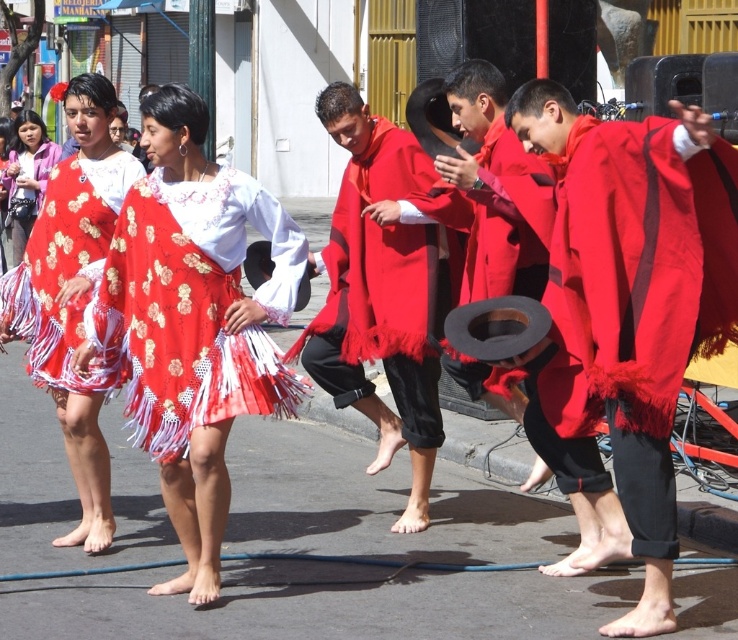
Question: Which of the following is the closest to the observer?

Choices:
 (A) red matte poncho at center
 (B) matte floral skirt at center
 (C) matte red dress at left

Answer: (B)

Question: From the image, what is the correct spatial relationship of matte red dress at center in relation to matte pink blouse at left?

Choices:
 (A) left
 (B) right

Answer: (B)

Question: Which point is farther to the camera?

Choices:
 (A) (297, 381)
 (B) (18, 161)

Answer: (B)

Question: Is matte pink blouse at left wider than matte red dress at left?

Choices:
 (A) yes
 (B) no

Answer: (A)

Question: Does matte floral skirt at center appear over matte red dress at center?

Choices:
 (A) no
 (B) yes

Answer: (A)

Question: Which of the following is the closest to the observer?

Choices:
 (A) matte pink blouse at left
 (B) matte red dress at center
 (C) red matte poncho at center
 (D) matte red poncho at center

Answer: (D)